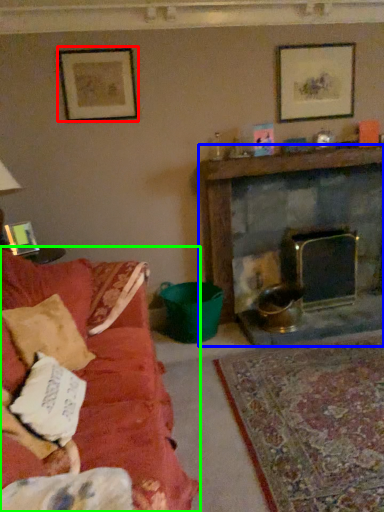
Question: Based on their relative distances, which object is nearer to picture frame (highlighted by a red box)? Choose from fireplace (highlighted by a blue box) and studio couch (highlighted by a green box).

Choices:
 (A) fireplace
 (B) studio couch

Answer: (A)